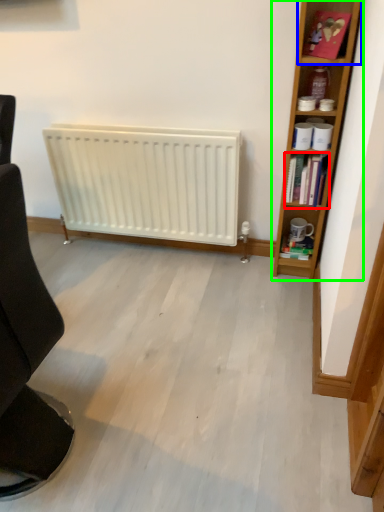
Question: Based on their relative distances, which object is nearer to book (highlighted by a red box)? Choose from cabinet (highlighted by a blue box) and bookcase (highlighted by a green box).

Choices:
 (A) cabinet
 (B) bookcase

Answer: (B)